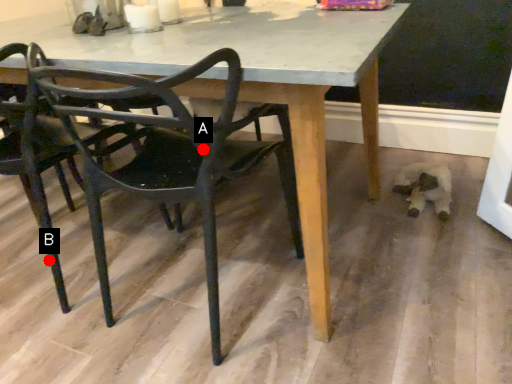
Question: Two points are circled on the image, labeled by A and B beside each circle. Which point is closer to the camera?

Choices:
 (A) A is closer
 (B) B is closer

Answer: (A)